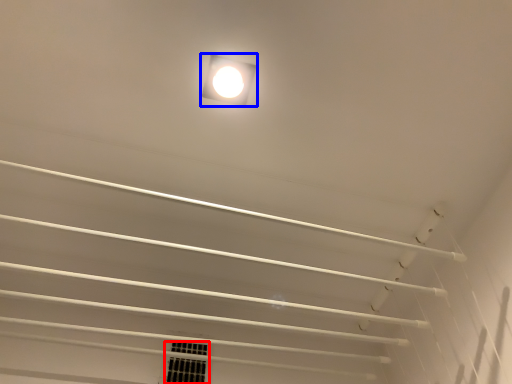
Question: Which point is closer to the camera, window (highlighted by a red box) or lamp (highlighted by a blue box)?

Choices:
 (A) window
 (B) lamp

Answer: (B)